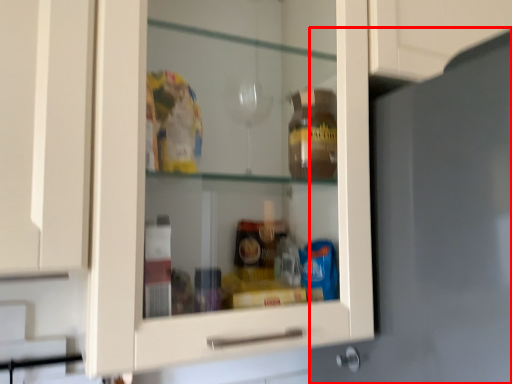
Question: From the image's perspective, considering the relative positions of door (annotated by the red box) and knob in the image provided, where is door (annotated by the red box) located with respect to the staircase?

Choices:
 (A) above
 (B) below

Answer: (A)